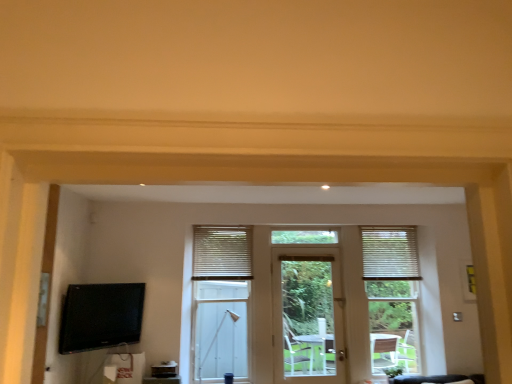
Question: From a real-world perspective, is white textured blinds at center, the 1th window blind in the left-to-right sequence, on black glossy tv at lower left?

Choices:
 (A) no
 (B) yes

Answer: (B)

Question: Is there a large distance between white textured blinds at center, the 1th window blind in the left-to-right sequence, and black glossy tv at lower left?

Choices:
 (A) yes
 (B) no

Answer: (B)

Question: Is white textured blinds at center, the second window blind when ordered from right to left, to the right of black glossy tv at lower left from the viewer's perspective?

Choices:
 (A) yes
 (B) no

Answer: (A)

Question: Considering the relative sizes of white textured blinds at center, the 1th window blind in the left-to-right sequence, and black glossy tv at lower left in the image provided, is white textured blinds at center, the 1th window blind in the left-to-right sequence, smaller than black glossy tv at lower left?

Choices:
 (A) no
 (B) yes

Answer: (B)

Question: Considering the relative sizes of white textured blinds at center, the second window blind when ordered from right to left, and black glossy tv at lower left in the image provided, is white textured blinds at center, the second window blind when ordered from right to left, thinner than black glossy tv at lower left?

Choices:
 (A) yes
 (B) no

Answer: (A)

Question: Is white textured blinds at center, the second window blind when ordered from right to left, looking in the opposite direction of black glossy tv at lower left?

Choices:
 (A) no
 (B) yes

Answer: (A)

Question: Can you confirm if white wooden door at center is positioned to the left of white textured blinds at center?

Choices:
 (A) yes
 (B) no

Answer: (B)

Question: Is white wooden door at center completely or partially outside of white textured blinds at center?

Choices:
 (A) no
 (B) yes

Answer: (B)

Question: Does white wooden door at center have a greater height compared to white textured blinds at center?

Choices:
 (A) yes
 (B) no

Answer: (B)

Question: Can you confirm if white wooden door at center is positioned to the right of white textured blinds at center?

Choices:
 (A) no
 (B) yes

Answer: (B)

Question: From a real-world perspective, is white wooden door at center under white textured blinds at center?

Choices:
 (A) no
 (B) yes

Answer: (B)

Question: Considering the relative sizes of white wooden door at center and white textured blinds at center in the image provided, is white wooden door at center smaller than white textured blinds at center?

Choices:
 (A) no
 (B) yes

Answer: (B)

Question: Can white textured blinds at right, the second window blind viewed from the left, be found inside black glossy tv at lower left?

Choices:
 (A) no
 (B) yes

Answer: (A)